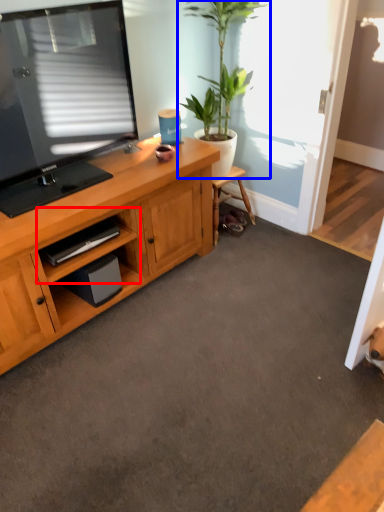
Question: Which object is further to the camera taking this photo, cabinet (highlighted by a red box) or houseplant (highlighted by a blue box)?

Choices:
 (A) cabinet
 (B) houseplant

Answer: (B)